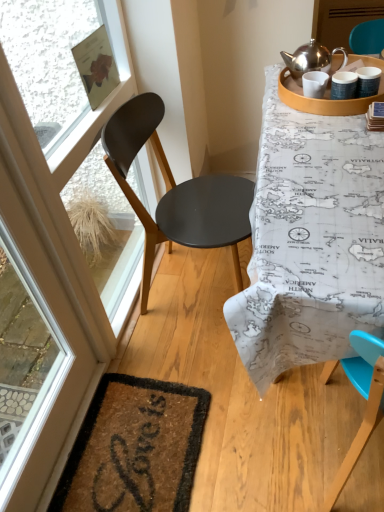
Question: Considering the relative sizes of matte brown screen door at upper right, positioned as the 1th screen door in right-to-left order, and brown coir mat at lower left in the image provided, is matte brown screen door at upper right, positioned as the 1th screen door in right-to-left order, wider than brown coir mat at lower left?

Choices:
 (A) yes
 (B) no

Answer: (B)

Question: Does matte brown screen door at upper right, positioned as the 1th screen door in right-to-left order, appear on the right side of brown coir mat at lower left?

Choices:
 (A) yes
 (B) no

Answer: (A)

Question: Considering the relative sizes of matte brown screen door at upper right, which appears as the second screen door when viewed from the left, and brown coir mat at lower left in the image provided, is matte brown screen door at upper right, which appears as the second screen door when viewed from the left, taller than brown coir mat at lower left?

Choices:
 (A) no
 (B) yes

Answer: (B)

Question: From a real-world perspective, is matte brown screen door at upper right, acting as the second screen door starting from the front, on brown coir mat at lower left?

Choices:
 (A) no
 (B) yes

Answer: (B)

Question: Considering the relative sizes of matte brown screen door at upper right, acting as the second screen door starting from the front, and brown coir mat at lower left in the image provided, is matte brown screen door at upper right, acting as the second screen door starting from the front, thinner than brown coir mat at lower left?

Choices:
 (A) yes
 (B) no

Answer: (A)

Question: From the image's perspective, is matte brown screen door at upper right, placed as the second screen door when sorted from bottom to top, on brown coir mat at lower left?

Choices:
 (A) no
 (B) yes

Answer: (B)

Question: Is the position of matte black chair at left less distant than that of matte brown screen door at upper right, acting as the second screen door starting from the front?

Choices:
 (A) no
 (B) yes

Answer: (B)

Question: From a real-world perspective, is matte black chair at left positioned over matte brown screen door at upper right, which is counted as the 1th screen door, starting from the back, based on gravity?

Choices:
 (A) no
 (B) yes

Answer: (A)

Question: Can you confirm if matte black chair at left is taller than matte brown screen door at upper right, which is counted as the 1th screen door, starting from the back?

Choices:
 (A) yes
 (B) no

Answer: (A)

Question: Is matte black chair at left aimed at matte brown screen door at upper right, positioned as the 1th screen door in right-to-left order?

Choices:
 (A) yes
 (B) no

Answer: (B)

Question: Is there a large distance between matte black chair at left and matte brown screen door at upper right, placed as the second screen door when sorted from bottom to top?

Choices:
 (A) no
 (B) yes

Answer: (B)

Question: Is matte black chair at left to the right of matte brown screen door at upper right, which is counted as the 1th screen door, starting from the back, from the viewer's perspective?

Choices:
 (A) yes
 (B) no

Answer: (B)

Question: Does matte wooden tray at upper right come in front of transparent glass window screen at upper left?

Choices:
 (A) yes
 (B) no

Answer: (B)